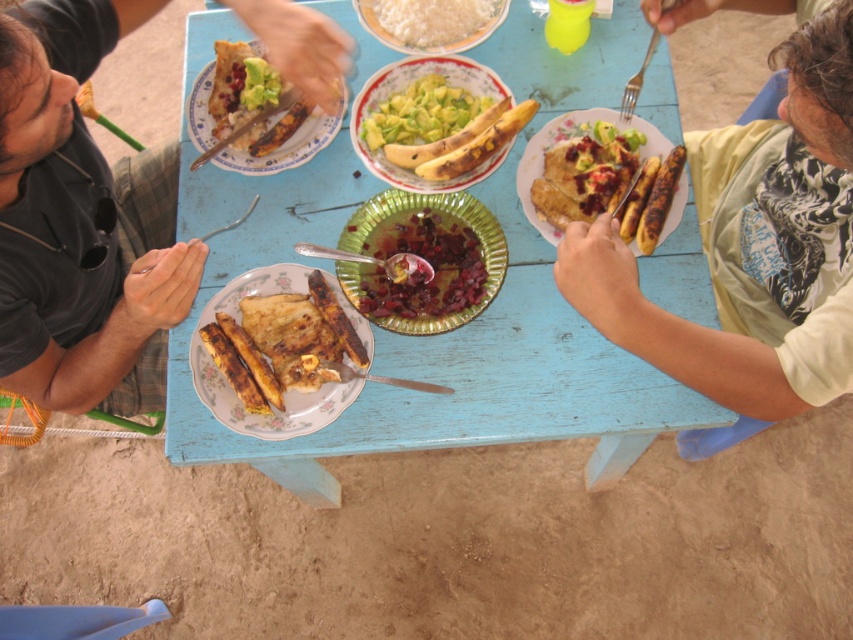
You are a food critic attending a beachside dinner and need to describe the location of the green matte platter at center relative to the table. Where exactly is it placed?

The green matte platter at center is positioned at point 0.138 on the x axis and 0.474 on the y axis relative to the table.

From the picture: You are a guest at this beachside table and want to reach for the green matte platter at center and the white matte rice at center. Which one is closer to you?

The green matte platter at center is located below the white matte rice at center, so the white matte rice at center is closer to you since it is above the platter.

You are a food delivery robot with a 30 cm wide tray. You need to place a new plate of food between the light green fabric shirt at upper right and the grilled banana at center. Can your tray fit in that space?

The distance between the light green fabric shirt at upper right and the grilled banana at center is 45.12 centimeters. Since your tray is only 30 cm wide, it can fit within the available space.